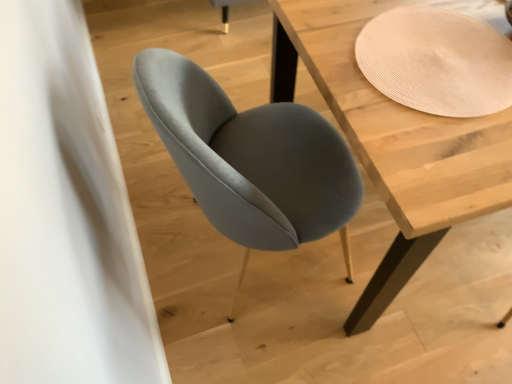
This screenshot has height=384, width=512. What do you see at coordinates (393, 142) in the screenshot?
I see `light wood table at center` at bounding box center [393, 142].

You are a GUI agent. You are given a task and a screenshot of the screen. Output one action in this format:
    pyautogui.click(x=<x>, y=<y>)
    Task: Click on the light wood table at center
    The width and height of the screenshot is (512, 384).
    Given the screenshot: What is the action you would take?
    pyautogui.click(x=393, y=142)

Find the location of a particular element. The height and width of the screenshot is (384, 512). suede gray chair at center is located at coordinates (250, 159).

Image resolution: width=512 pixels, height=384 pixels. What do you see at coordinates (250, 159) in the screenshot?
I see `suede gray chair at center` at bounding box center [250, 159].

Where is `light wood table at center`? This screenshot has width=512, height=384. light wood table at center is located at coordinates (393, 142).

Which is more to the right, light wood table at center or suede gray chair at center?

light wood table at center.

Considering the positions of objects light wood table at center and suede gray chair at center in the image provided, who is in front, light wood table at center or suede gray chair at center?

Positioned in front is suede gray chair at center.

Which is nearer, (435, 236) or (307, 211)?

Point (435, 236) appears to be farther away from the viewer than point (307, 211).

Consider the image. From the image's perspective, which object appears higher, light wood table at center or suede gray chair at center?

light wood table at center, from the image's perspective.

From a real-world perspective, which is physically below, light wood table at center or suede gray chair at center?

From a 3D spatial view, light wood table at center is below.

Considering the sizes of light wood table at center and suede gray chair at center in the image, is light wood table at center wider or thinner than suede gray chair at center?

Clearly, light wood table at center has more width compared to suede gray chair at center.

Is light wood table at center taller or shorter than suede gray chair at center?

In the image, light wood table at center appears to be shorter than suede gray chair at center.

Is light wood table at center smaller than suede gray chair at center?

No, light wood table at center is not smaller than suede gray chair at center.

Is light wood table at center spatially inside suede gray chair at center, or outside of it?

light wood table at center is spatially situated outside suede gray chair at center.

Are light wood table at center and suede gray chair at center far apart?

light wood table at center is actually quite close to suede gray chair at center.

Could you tell me if light wood table at center is facing suede gray chair at center?

No, light wood table at center is not oriented towards suede gray chair at center.

Measure the distance between light wood table at center and suede gray chair at center.

light wood table at center and suede gray chair at center are 11.87 inches apart.

At what (x,y) coordinates should I click in order to perform the action: click on table below the suede gray chair at center (from a real-world perspective). Please return your answer as a coordinate pair (x, y). Looking at the image, I should click on (393, 142).

Which is more to the right, suede gray chair at center or light wood table at center?

Positioned to the right is light wood table at center.

In the image, is suede gray chair at center positioned in front of or behind light wood table at center?

suede gray chair at center is in front of light wood table at center.

Considering the positions of point (302, 179) and point (394, 121), is point (302, 179) closer or farther from the camera than point (394, 121)?

Point (302, 179) is positioned farther from the camera compared to point (394, 121).

From the image's perspective, is suede gray chair at center above light wood table at center?

No, from the image's perspective, suede gray chair at center is not on top of light wood table at center.

From a real-world perspective, between suede gray chair at center and light wood table at center, who is vertically higher?

From a 3D spatial view, suede gray chair at center is above.

Considering the sizes of suede gray chair at center and light wood table at center in the image, is suede gray chair at center wider or thinner than light wood table at center?

suede gray chair at center is thinner than light wood table at center.

Is suede gray chair at center taller than light wood table at center?

Indeed, suede gray chair at center has a greater height compared to light wood table at center.

Is suede gray chair at center smaller than light wood table at center?

Correct, suede gray chair at center occupies less space than light wood table at center.

Would you say suede gray chair at center is outside light wood table at center?

That's correct, suede gray chair at center is outside of light wood table at center.

Is suede gray chair at center not close to light wood table at center?

No, suede gray chair at center is in close proximity to light wood table at center.

Is suede gray chair at center looking in the opposite direction of light wood table at center?

No, suede gray chair at center is not facing away from light wood table at center.

Can you tell me how much suede gray chair at center and light wood table at center differ in facing direction?

90.4 degrees separate the facing orientations of suede gray chair at center and light wood table at center.

How much distance is there between suede gray chair at center and light wood table at center?

The distance of suede gray chair at center from light wood table at center is 11.87 inches.

The width and height of the screenshot is (512, 384). In order to click on table that appears below the suede gray chair at center (from a real-world perspective) in this screenshot , I will do `click(393, 142)`.

The height and width of the screenshot is (384, 512). Identify the location of table on the right of suede gray chair at center. (393, 142).

At what (x,y) coordinates should I click in order to perform the action: click on chair in front of the light wood table at center. Please return your answer as a coordinate pair (x, y). This screenshot has width=512, height=384. Looking at the image, I should click on (250, 159).